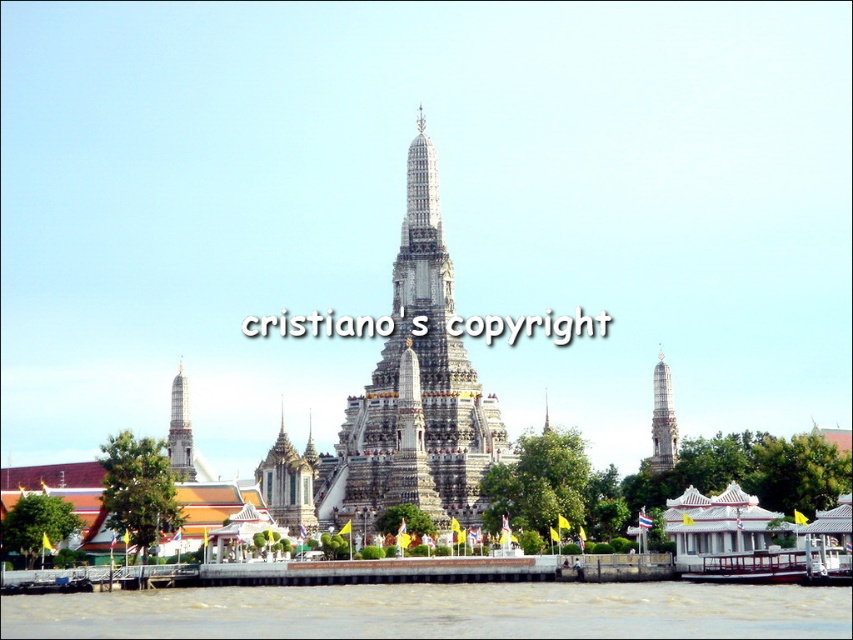
You are an architect planning to add a new structure to the riverside temple complex. You have two options for placement based on the existing structures. The silver metallic spire at lower left and the white marble tower at left are both in your view. Which existing structure would allow more space for your new addition if you want to place it next to them?

The white marble tower at left occupies more space than the silver metallic spire at lower left, so placing the new structure next to the white marble tower at left would allow more space for the new addition.

You are a photographer standing at the riverside facing the temple complex. You want to capture a photo that includes both the silver metallic spire at lower left and the white marble tower at left. Which object should you adjust your camera angle to focus on first to ensure both are in frame?

The silver metallic spire at lower left is below the white marble tower at left. To include both in the frame, you should first focus on the lower position of the silver metallic spire at lower left to ensure the upper white marble tower at left is also captured.

You are standing at the point marked as point (415, 388) in the image. What is the nearest object to you in the riverside temple scene?

The nearest object to you at point (415, 388) is the white stone temple at center, as you are standing exactly at its location.